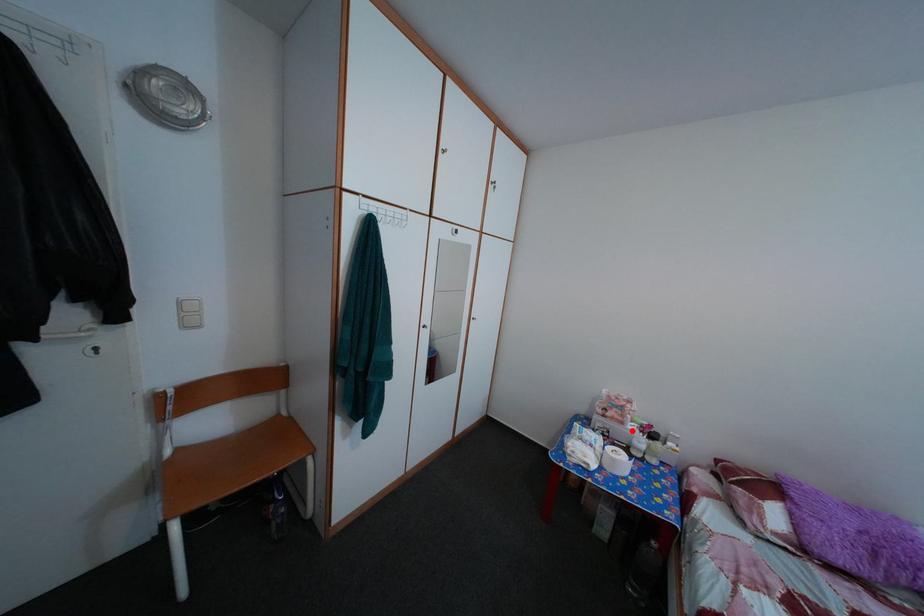
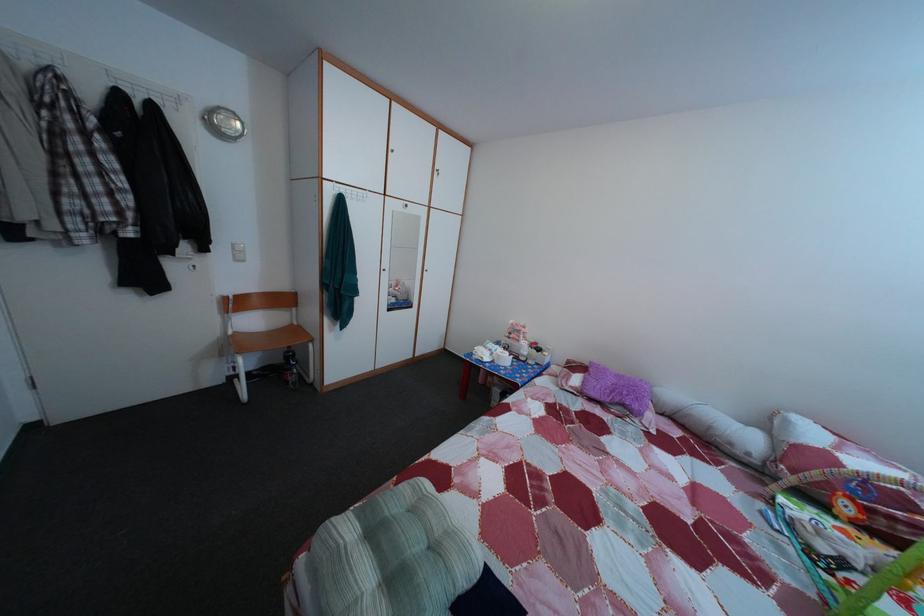
Locate, in the second image, the point that corresponds to the highlighted location in the first image.

(528, 349)